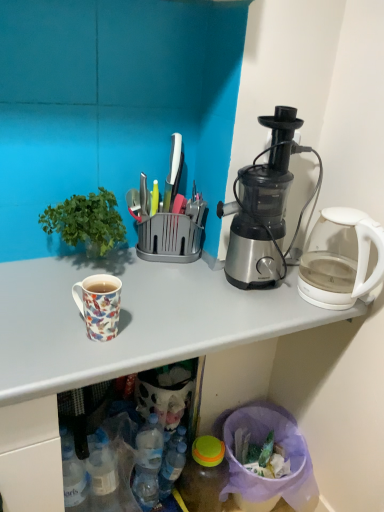
Locate an element on the screen. This screenshot has height=512, width=384. space that is in front of green leafy plant at left is located at coordinates (57, 315).